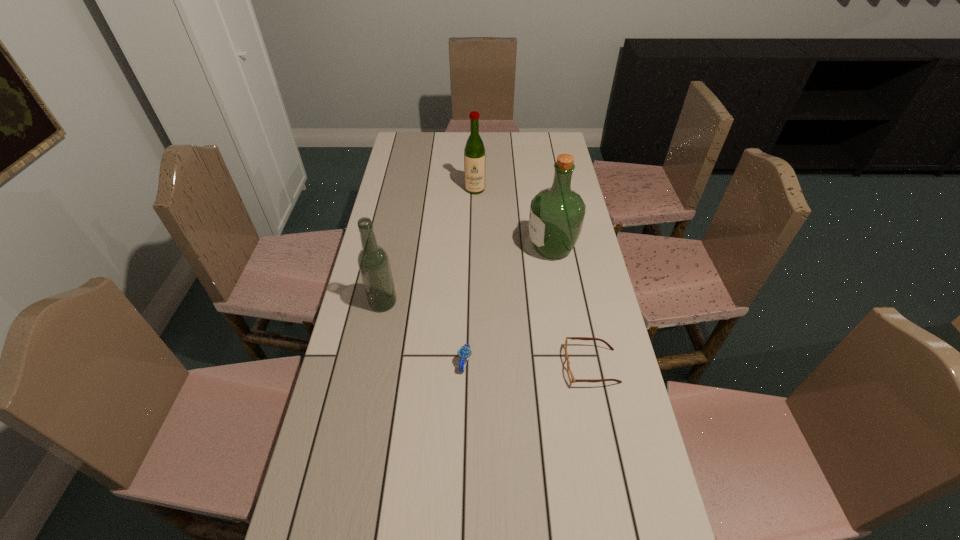
Identify the location of the second farthest liquor. The height and width of the screenshot is (540, 960). (556, 217).

Find the location of `the rightmost liquor`. the rightmost liquor is located at coordinates (556, 217).

Locate an element on the screen. the second liquor from right to left is located at coordinates (x=474, y=153).

This screenshot has width=960, height=540. I want to click on the farthest liquor, so click(x=474, y=153).

This screenshot has width=960, height=540. What are the coordinates of `the nearest liquor` in the screenshot? It's located at (373, 261).

This screenshot has width=960, height=540. I want to click on the leftmost liquor, so click(373, 261).

I want to click on watch, so click(464, 352).

This screenshot has width=960, height=540. In order to click on spectacles in this screenshot , I will do `click(570, 374)`.

You are a GUI agent. You are given a task and a screenshot of the screen. Output one action in this format:
    pyautogui.click(x=<x>, y=<y>)
    Task: Click on the vacant position located 0.380m on the front-facing side of the rightmost liquor
    The image size is (960, 540).
    Given the screenshot: What is the action you would take?
    pyautogui.click(x=420, y=248)

Where is `vacant space located on the front-facing side of the rightmost liquor`? vacant space located on the front-facing side of the rightmost liquor is located at coordinates click(498, 248).